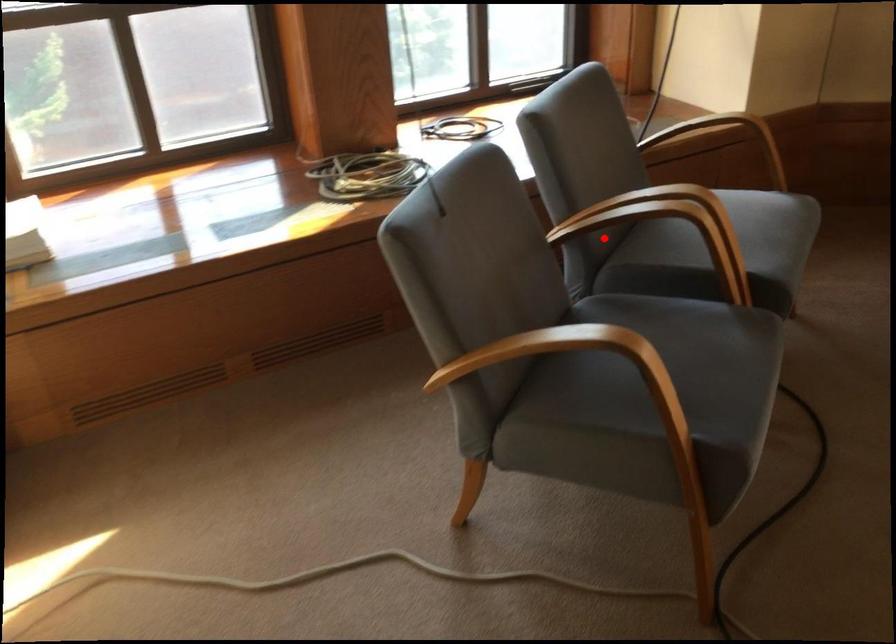
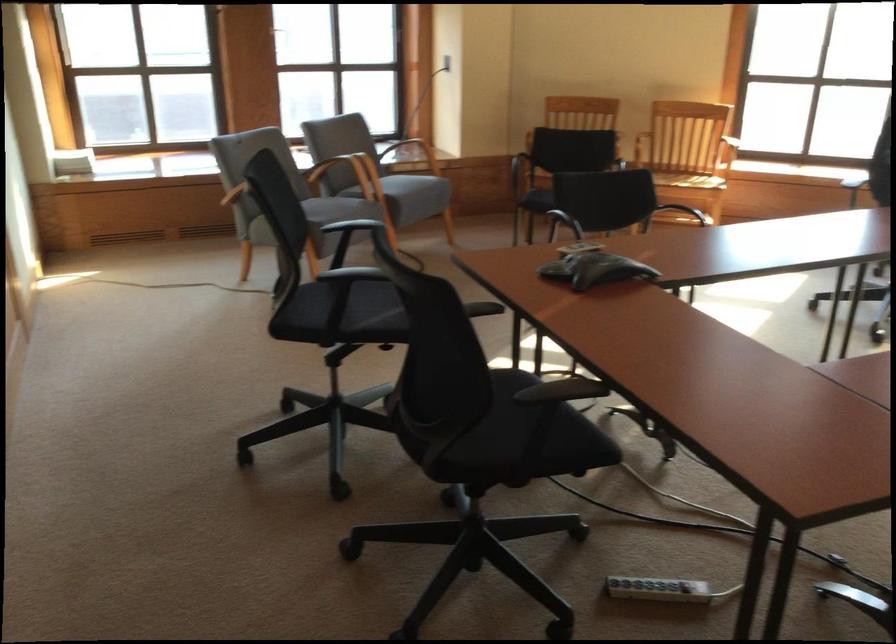
Question: I am providing you with two images of the same scene from different viewpoints. In image1, a red point is highlighted. Considering the same 3D point in image2, which of the following is correct?

Choices:
 (A) It is closer
 (B) It is farther

Answer: (B)